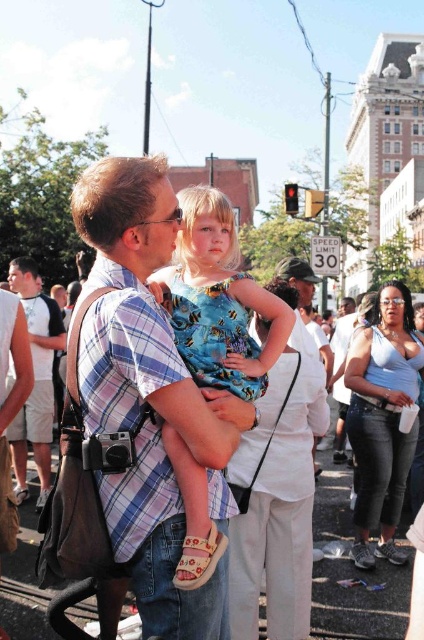
Question: Is matte blue tank top at center positioned at the back of light brown plaid shirt at center?

Choices:
 (A) no
 (B) yes

Answer: (B)

Question: Can you confirm if plaid shirt at center is wider than matte blue tank top at center?

Choices:
 (A) no
 (B) yes

Answer: (B)

Question: Among these objects, which one is nearest to the camera?

Choices:
 (A) plaid shirt at center
 (B) light brown plaid shirt at center
 (C) blue printed dress at center
 (D) matte blue tank top at center

Answer: (A)

Question: Based on their relative distances, which object is farther from the matte blue tank top at center?

Choices:
 (A) blue printed dress at center
 (B) light brown plaid shirt at center

Answer: (B)

Question: Can you confirm if plaid shirt at center is thinner than matte blue tank top at center?

Choices:
 (A) yes
 (B) no

Answer: (B)

Question: Which of these objects is positioned farthest from the plaid shirt at center?

Choices:
 (A) matte blue tank top at center
 (B) blue printed dress at center

Answer: (A)